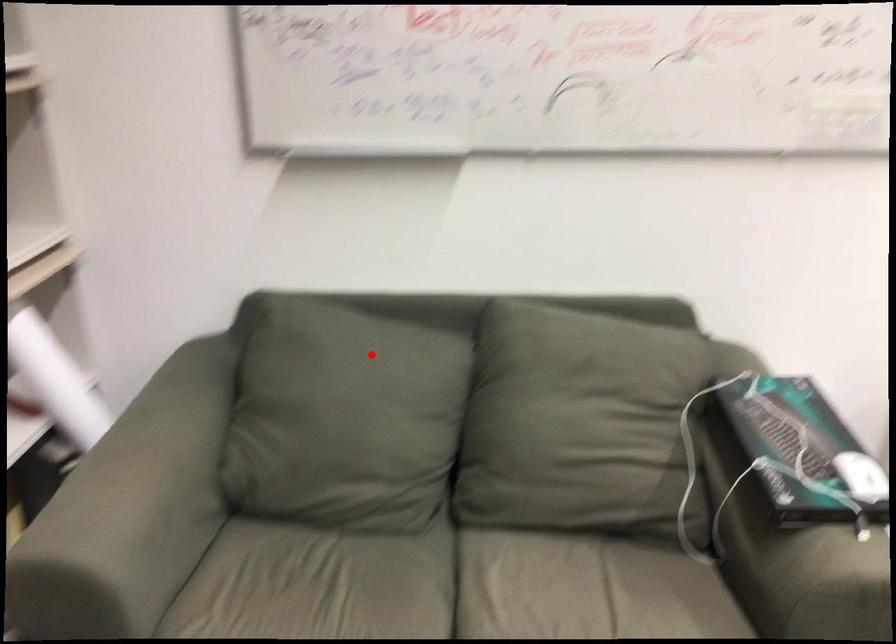
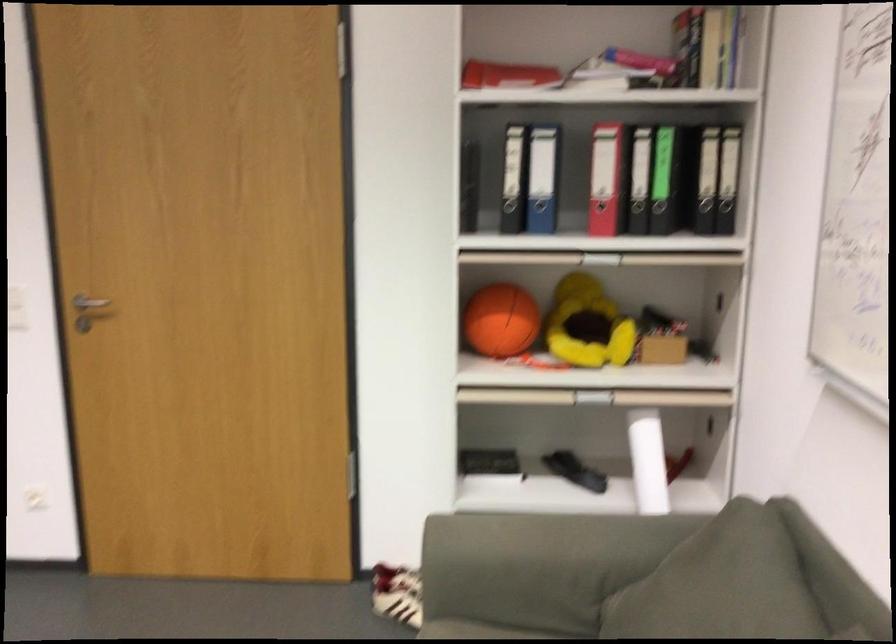
Question: I am providing you with two images of the same scene from different viewpoints. Given a red point in image1, look at the same physical point in image2. Is it:

Choices:
 (A) Closer to the viewpoint
 (B) Farther from the viewpoint

Answer: (A)